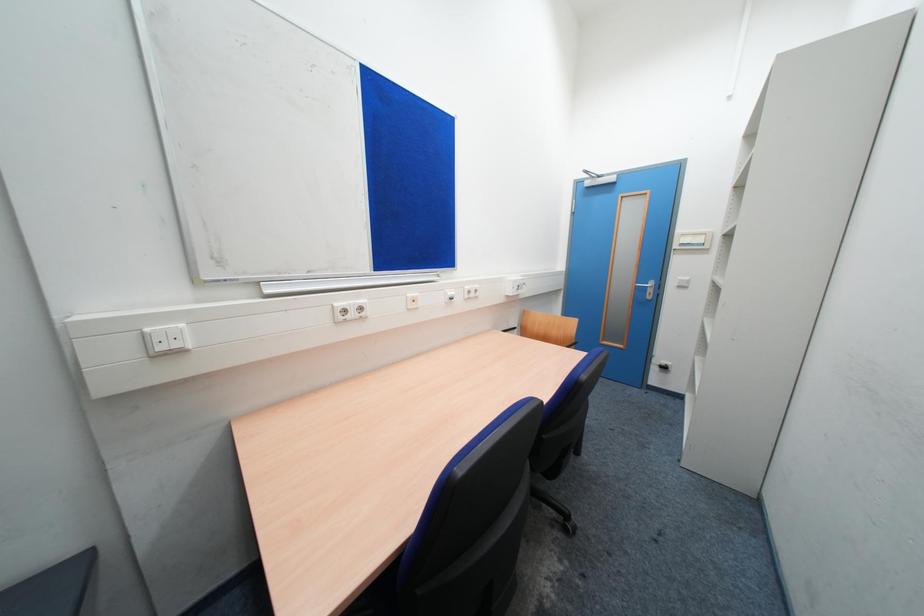
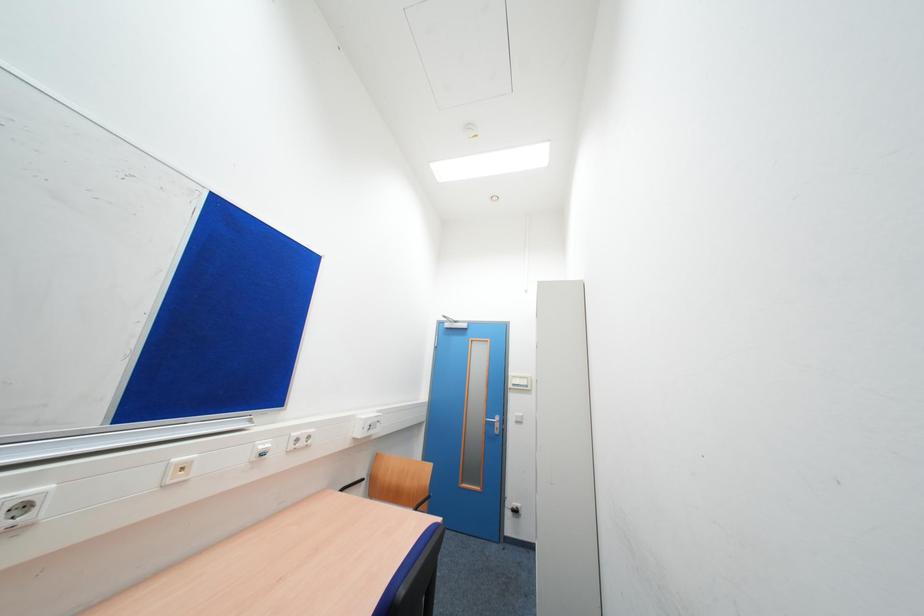
The images are taken continuously from a first-person perspective. In which direction is your viewpoint rotating?

The camera rotated toward right-up.